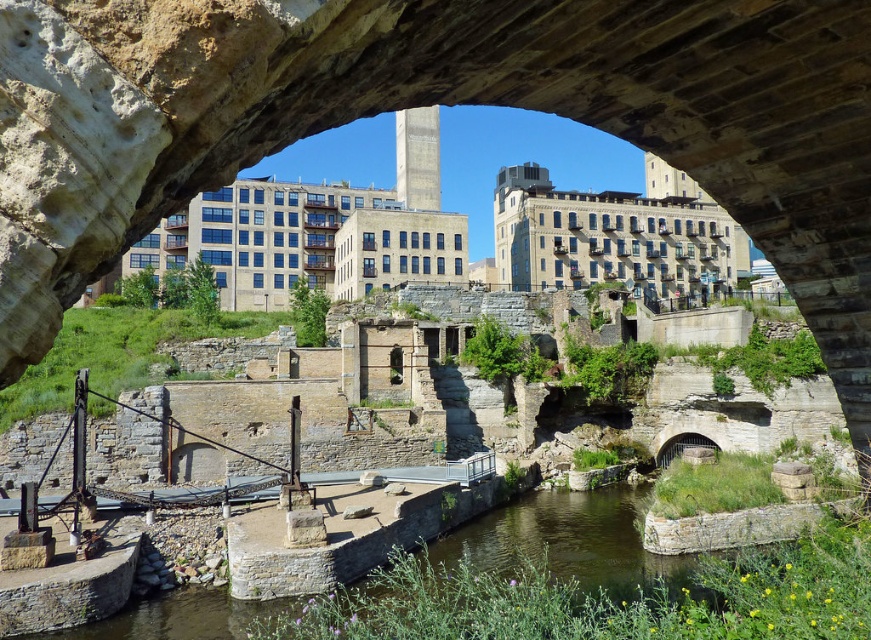
Is stone arch bridge at center below clear water at center?

No, stone arch bridge at center is not below clear water at center.

The image size is (871, 640). I want to click on stone arch bridge at center, so click(x=431, y=104).